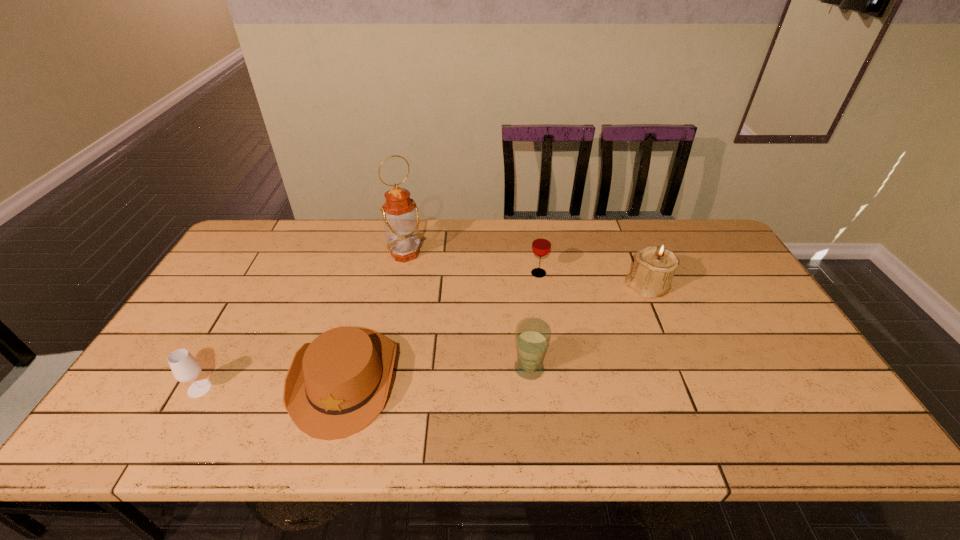
I want to click on oil lamp, so click(x=400, y=213).

Where is `the farthest object`? This screenshot has width=960, height=540. the farthest object is located at coordinates (400, 213).

Identify the location of candle_holder. (653, 269).

In order to click on the farthest glass in this screenshot , I will do `click(541, 244)`.

This screenshot has width=960, height=540. I want to click on the shortest glass, so click(x=185, y=368).

Where is `the leftmost object`? The image size is (960, 540). the leftmost object is located at coordinates (185, 368).

Locate an element on the screen. the shortest object is located at coordinates (336, 385).

Identify the location of free space located on the left of the oil lamp. The image size is (960, 540). (354, 254).

Where is `vacant space located on the back of the rightmost object`? The width and height of the screenshot is (960, 540). vacant space located on the back of the rightmost object is located at coordinates (626, 236).

Where is `free location located on the left of the farthest glass`? The height and width of the screenshot is (540, 960). free location located on the left of the farthest glass is located at coordinates (471, 274).